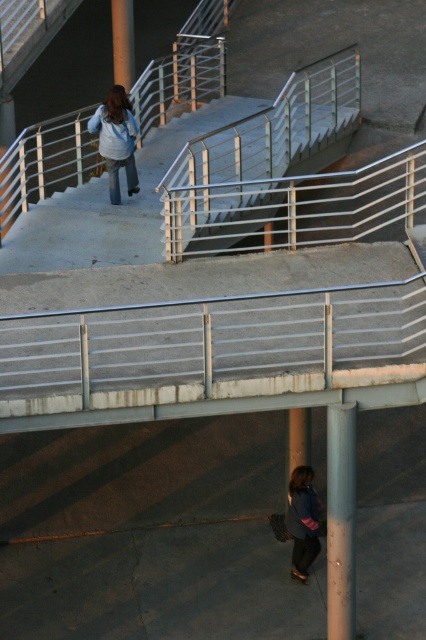
Is dark blue fabric jacket at lower center smaller than smooth concrete pillar at upper center?

Yes.

Between dark blue fabric jacket at lower center and smooth concrete pillar at upper center, which one appears on the right side from the viewer's perspective?

dark blue fabric jacket at lower center is more to the right.

What are the coordinates of `dark blue fabric jacket at lower center` in the screenshot? It's located at (302, 520).

Between metallic silver handrail at upper left and smooth concrete pillar at upper center, which one is positioned higher?

smooth concrete pillar at upper center is higher up.

Is point (235, 118) farther from viewer compared to point (112, 26)?

No, (235, 118) is in front of (112, 26).

Locate an element on the screen. The image size is (426, 640). metallic silver handrail at upper left is located at coordinates [111, 205].

Who is shorter, light blue denim jacket at upper center or smooth concrete pillar at upper center?

With less height is light blue denim jacket at upper center.

Between point (127, 157) and point (123, 83), which one is positioned in front?

Positioned in front is point (127, 157).

Is point (115, 106) positioned after point (120, 26)?

No, it is not.

Find the location of a particular element. light blue denim jacket at upper center is located at coordinates (117, 140).